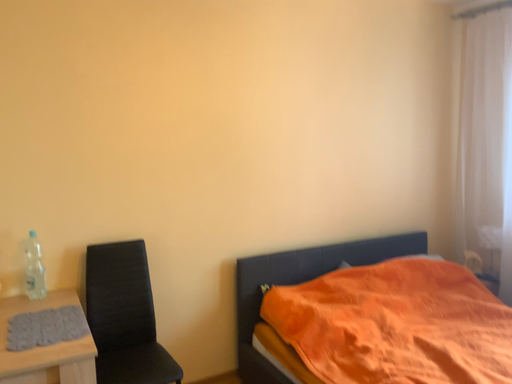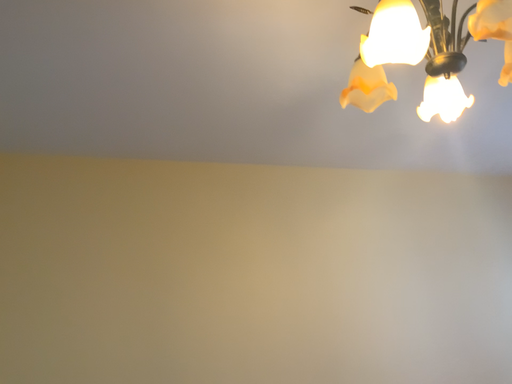
Question: Which way did the camera rotate in the video?

Choices:
 (A) rotated downward
 (B) rotated upward

Answer: (B)